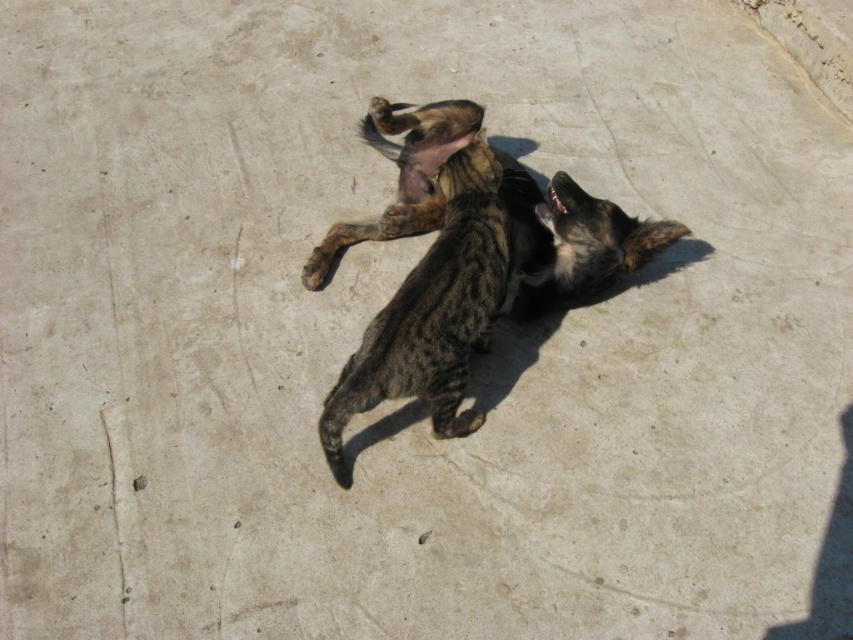
Does brown fur dog at center lie behind dark brown fur paw at upper center?

No, it is not.

Identify the location of brown fur dog at center. Image resolution: width=853 pixels, height=640 pixels. (570, 241).

Where is `brown fur dog at center`? This screenshot has width=853, height=640. brown fur dog at center is located at coordinates (570, 241).